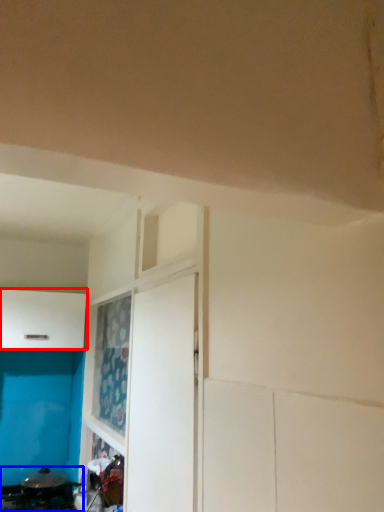
Question: Which of the following is the farthest to the observer, cabinetry (highlighted by a red box) or appliance (highlighted by a blue box)?

Choices:
 (A) cabinetry
 (B) appliance

Answer: (A)